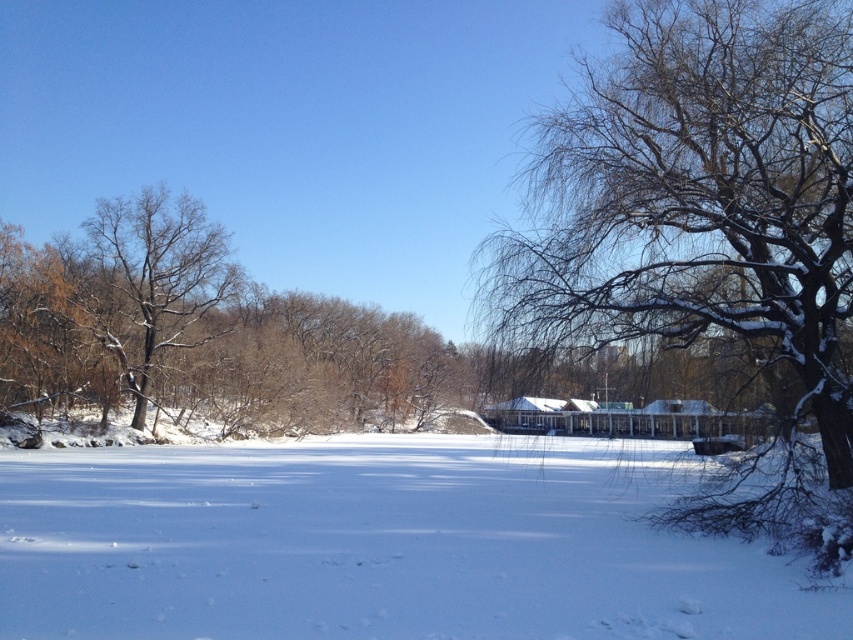
Which is behind, point (167, 596) or point (567, 108)?

The point (567, 108) is behind.

Which is above, white powdery snow at center or snow-covered branches at center?

snow-covered branches at center is higher up.

Is point (227, 525) positioned after point (663, 17)?

No, it is not.

You are a GUI agent. You are given a task and a screenshot of the screen. Output one action in this format:
    pyautogui.click(x=<x>, y=<y>)
    Task: Click on the white powdery snow at center
    This screenshot has width=853, height=640.
    Given the screenshot: What is the action you would take?
    pyautogui.click(x=381, y=545)

Which of these two, snow-covered branches at center or brown/dry wood tree at left, stands taller?

Standing taller between the two is brown/dry wood tree at left.

Can you confirm if snow-covered branches at center is bigger than brown/dry wood tree at left?

Actually, snow-covered branches at center might be smaller than brown/dry wood tree at left.

Describe the element at coordinates (699, 198) in the screenshot. I see `snow-covered branches at center` at that location.

The width and height of the screenshot is (853, 640). I want to click on snow-covered branches at center, so click(x=699, y=198).

Can you confirm if white powdery snow at center is bigger than brown/dry wood tree at left?

Indeed, white powdery snow at center has a larger size compared to brown/dry wood tree at left.

Find the location of a particular element. This screenshot has width=853, height=640. white powdery snow at center is located at coordinates (381, 545).

This screenshot has height=640, width=853. Describe the element at coordinates (381, 545) in the screenshot. I see `white powdery snow at center` at that location.

This screenshot has height=640, width=853. I want to click on white powdery snow at center, so click(x=381, y=545).